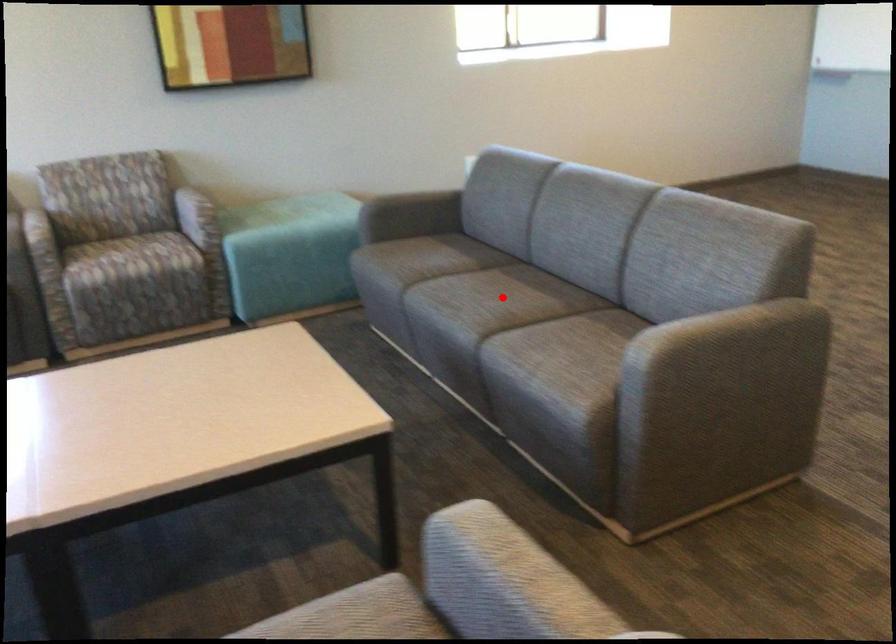
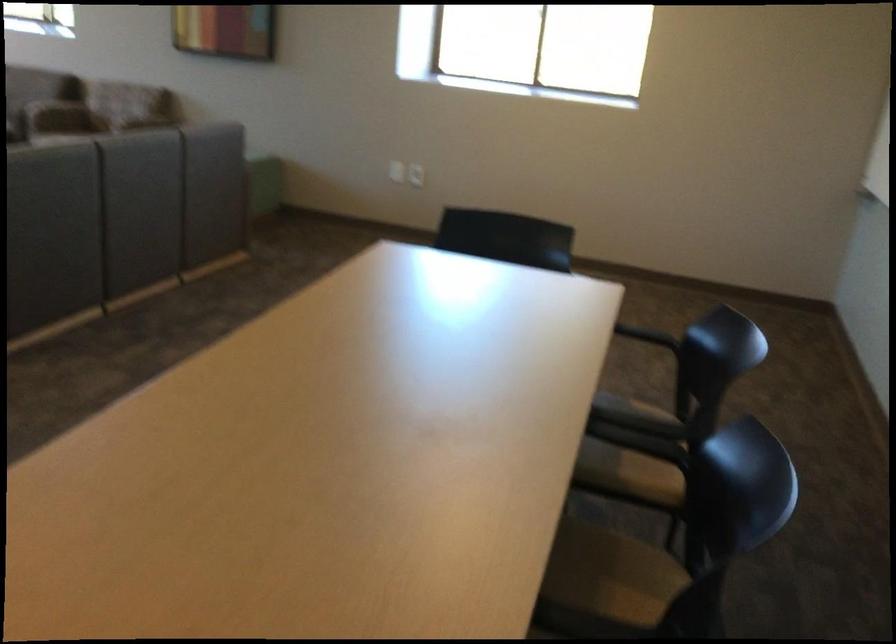
Question: I am providing you with two images of the same scene from different viewpoints. A red point is marked on the first image. Is the red point's position out of view in image 2?

Choices:
 (A) Yes
 (B) No

Answer: (A)